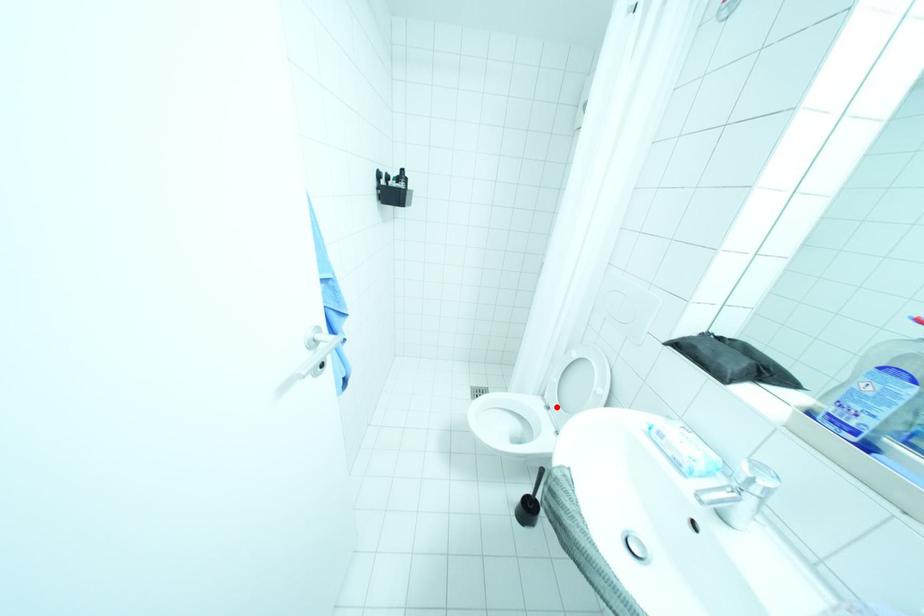
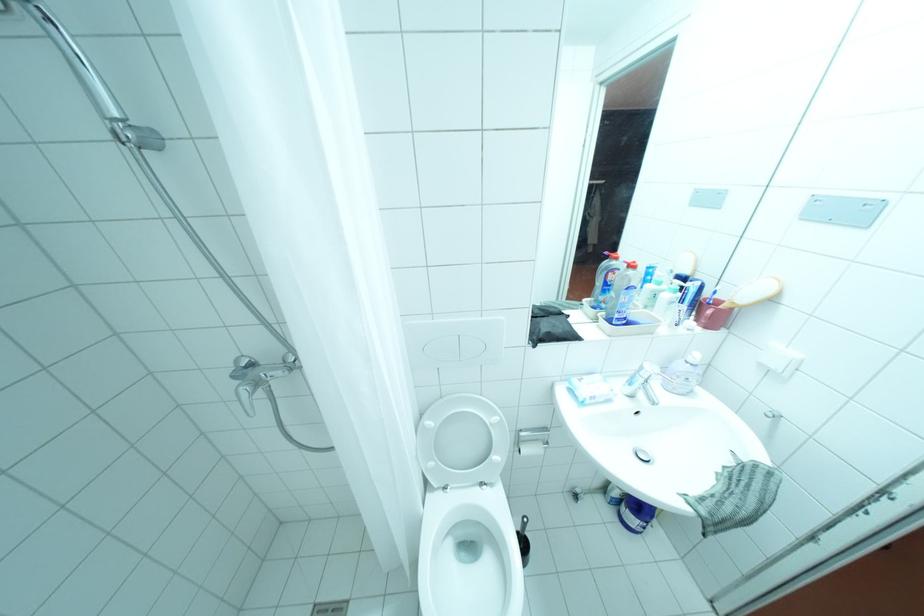
Question: I am providing you with two images of the same scene from different viewpoints. Given a red point in image1, look at the same physical point in image2. Is it:

Choices:
 (A) Closer to the viewpoint
 (B) Farther from the viewpoint

Answer: (B)